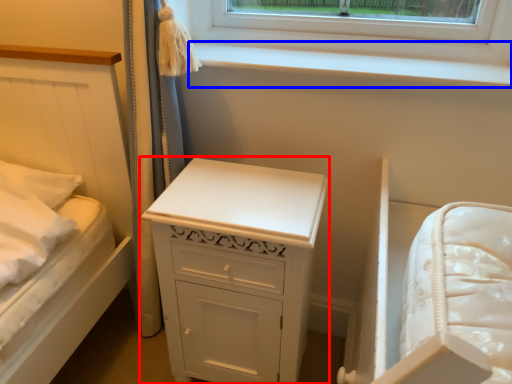
Question: Which object is further to the camera taking this photo, chest of drawers (highlighted by a red box) or window sill (highlighted by a blue box)?

Choices:
 (A) chest of drawers
 (B) window sill

Answer: (B)